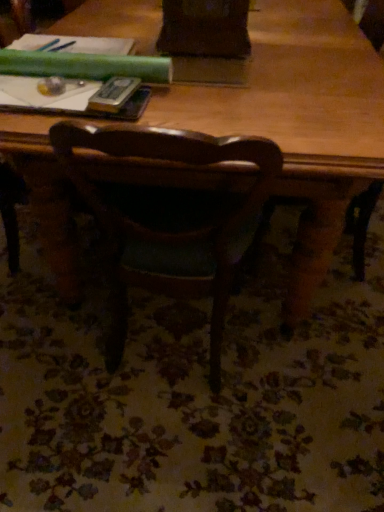
The height and width of the screenshot is (512, 384). I want to click on vacant space to the right of metallic silver paperback book at upper center, so click(186, 103).